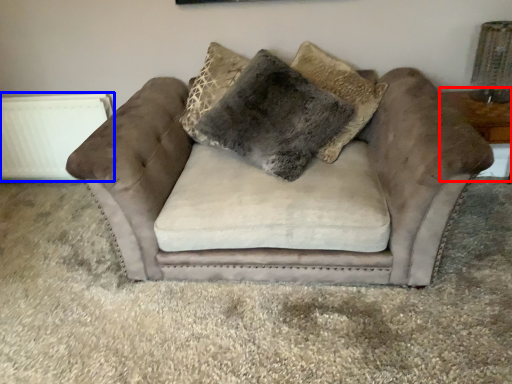
Question: Among these objects, which one is nearest to the camera, table (highlighted by a red box) or radiator (highlighted by a blue box)?

Choices:
 (A) table
 (B) radiator

Answer: (A)